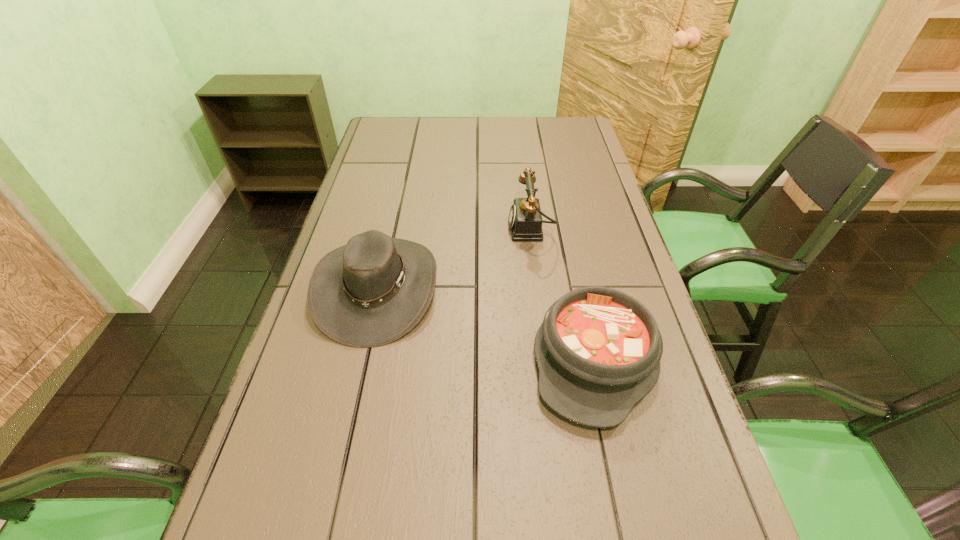
Find the location of a particular element. The height and width of the screenshot is (540, 960). tote bag located at the right edge is located at coordinates (480, 52).

Where is `detergent present at the right edge`? The width and height of the screenshot is (960, 540). detergent present at the right edge is located at coordinates (618, 302).

This screenshot has width=960, height=540. I want to click on object present at the far right corner, so click(480, 52).

Where is `vacant space at the far edge`? vacant space at the far edge is located at coordinates (454, 122).

This screenshot has height=540, width=960. I want to click on vacant area at the left edge, so click(371, 262).

What are the coordinates of `free space at the right edge of the desktop` in the screenshot? It's located at (643, 516).

Locate an element on the screen. The width and height of the screenshot is (960, 540). vacant position at the far right corner of the desktop is located at coordinates (562, 127).

Where is `free spot between the shopping bag and the right red detergent`? This screenshot has height=540, width=960. free spot between the shopping bag and the right red detergent is located at coordinates (439, 277).

Locate an element on the screen. This screenshot has width=960, height=540. unoccupied position between the bigger red detergent and the tote bag is located at coordinates coord(403,264).

Locate an element on the screen. The height and width of the screenshot is (540, 960). empty space between the rightmost white detergent and the shopping bag is located at coordinates (503, 265).